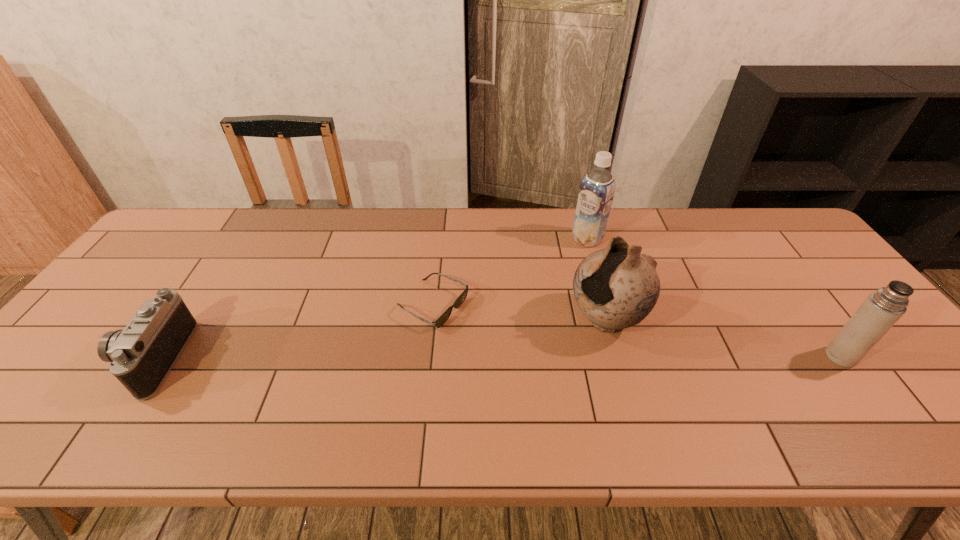
This screenshot has width=960, height=540. I want to click on object that is the third closest one to the farthest object, so click(x=883, y=308).

I want to click on blank space that satisfies the following two spatial constraints: 1. on the front side of the sunglasses; 2. on the right side of the thermos bottle, so click(427, 356).

Where is `blank area in the image that satisfies the following two spatial constraints: 1. on the front side of the third shortest object; 2. on the right side of the fourth object from right to left`? blank area in the image that satisfies the following two spatial constraints: 1. on the front side of the third shortest object; 2. on the right side of the fourth object from right to left is located at coordinates (427, 356).